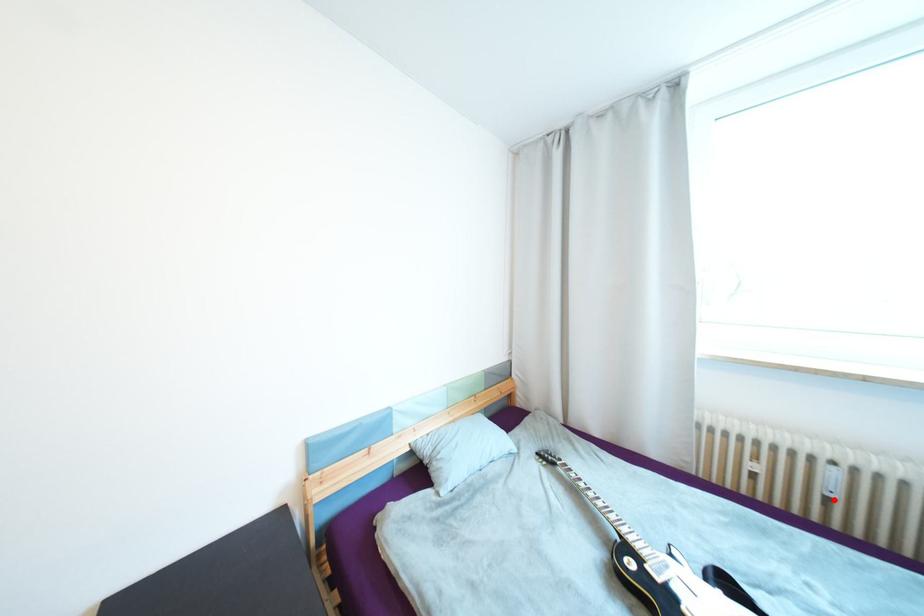
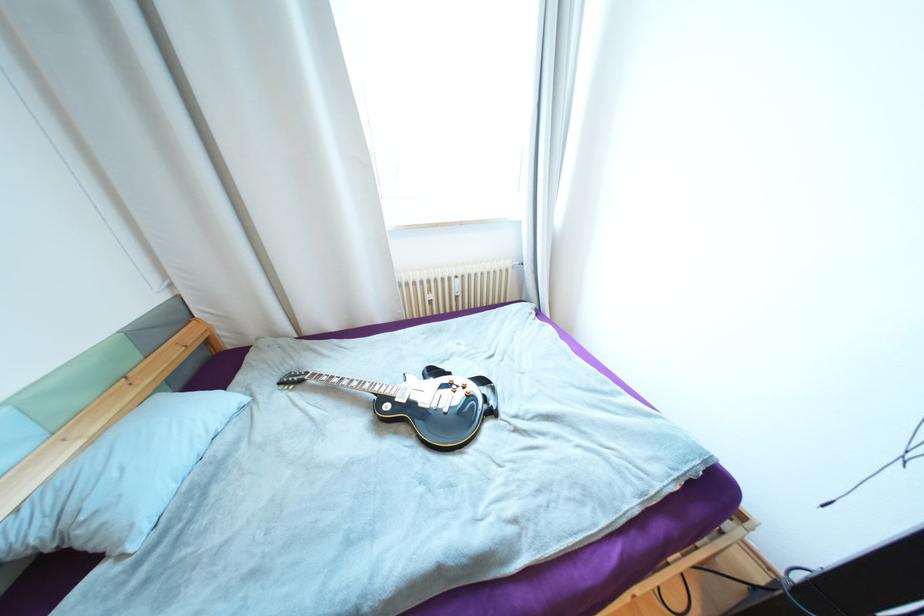
In the second image, find the point that corresponds to the highlighted location in the first image.

(463, 297)